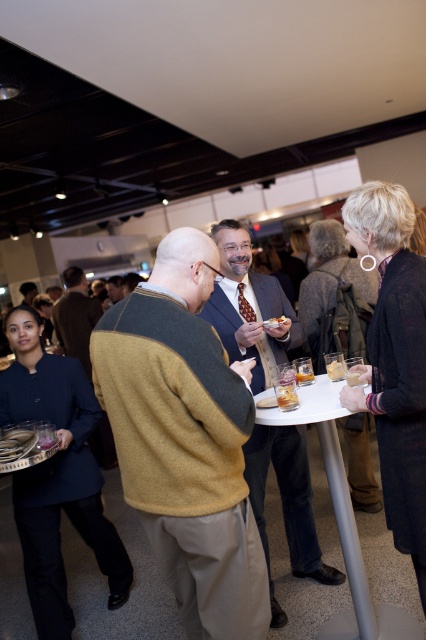
Question: Does knit sweater at center appear over clear glass at center?

Choices:
 (A) yes
 (B) no

Answer: (B)

Question: From the image, what is the correct spatial relationship of translucent glass at lower center in relation to clear glass at center?

Choices:
 (A) left
 (B) right

Answer: (B)

Question: Does dark blue wool coat at center lie behind brown textured coat at center?

Choices:
 (A) no
 (B) yes

Answer: (A)

Question: Among these objects, which one is farthest from the camera?

Choices:
 (A) dark blue wool coat at center
 (B) clear glass at center

Answer: (B)

Question: Which of the following is the farthest from the observer?

Choices:
 (A) (322, 282)
 (B) (344, 372)

Answer: (A)

Question: Which object is farther from the camera taking this photo?

Choices:
 (A) knit sweater at center
 (B) matte brown suit at center
 (C) clear glass at center
 (D) dark blue uniform at center

Answer: (D)